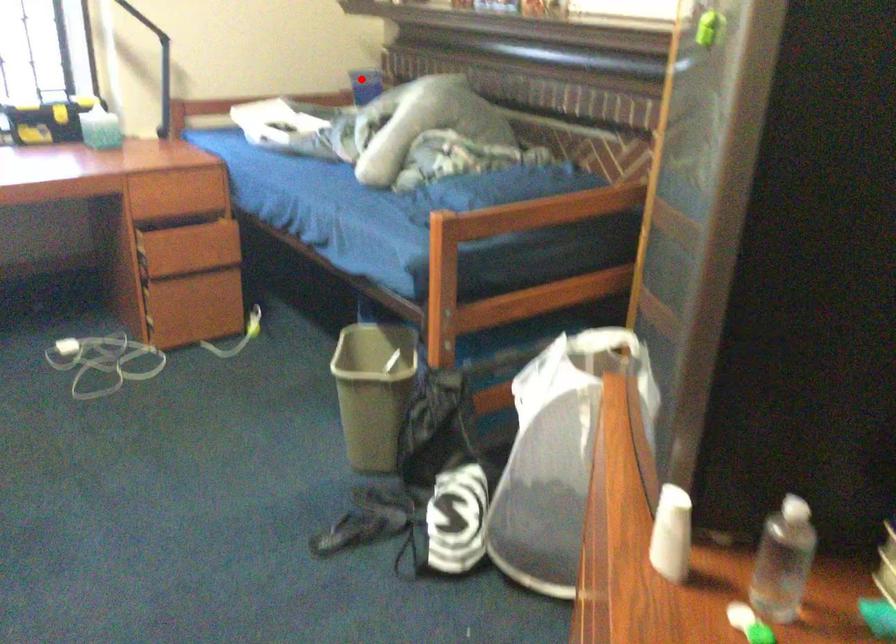
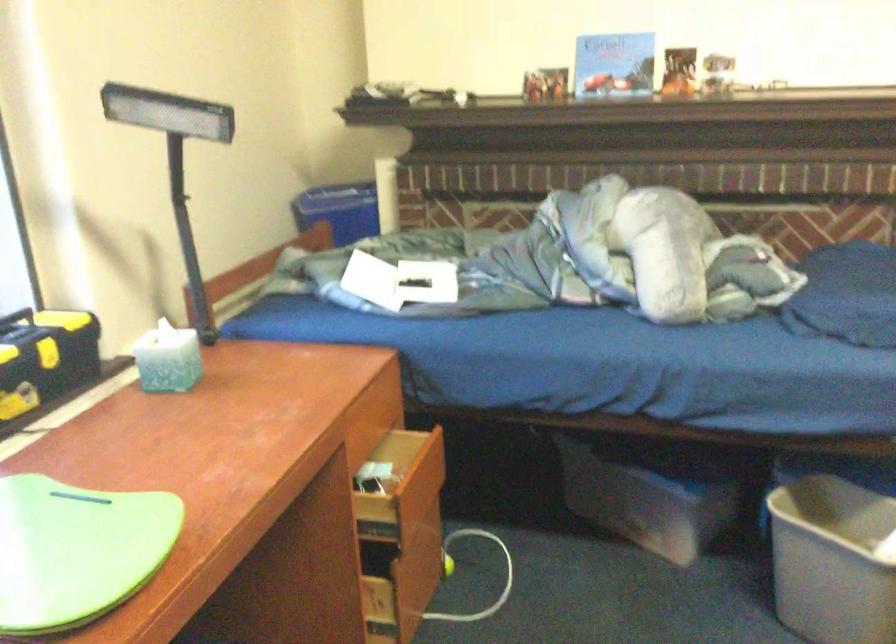
The point at the highlighted location is marked in the first image. Where is the corresponding point in the second image?

(339, 210)